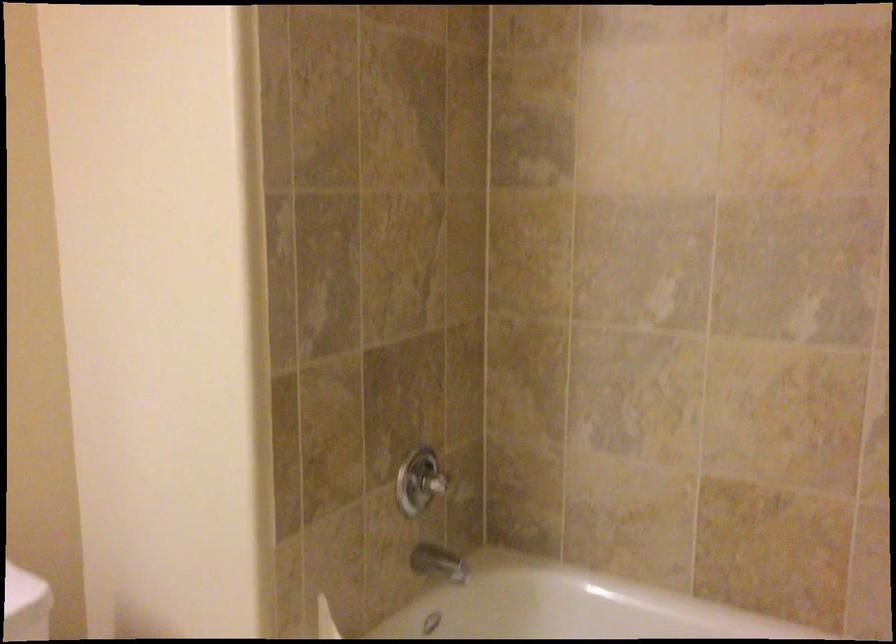
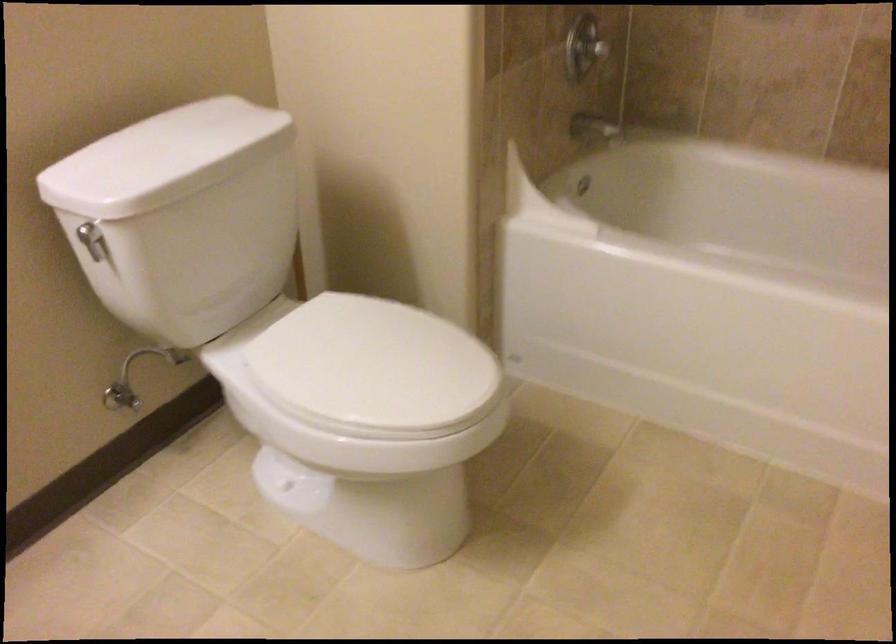
Question: The images are taken continuously from a first-person perspective. In which direction is your viewpoint rotating?

Choices:
 (A) Left
 (B) Right
 (C) Up
 (D) Down

Answer: (D)